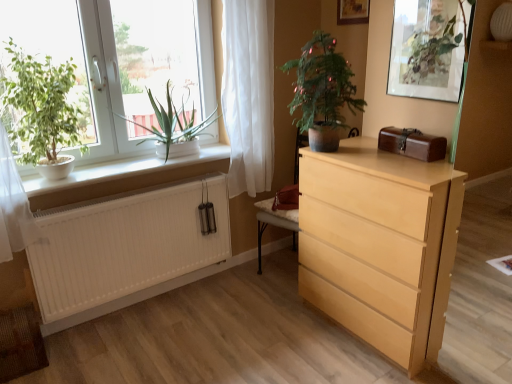
Question: Considering their positions, is white sheer curtain at upper center located in front of or behind green matte plant at left, which is counted as the third houseplant, starting from the right?

Choices:
 (A) behind
 (B) front

Answer: (A)

Question: From a real-world perspective, is white sheer curtain at upper center positioned above or below green matte plant at left, the first houseplant viewed from the left?

Choices:
 (A) below
 (B) above

Answer: (A)

Question: Based on their relative distances, which object is farther from the white plastic window at left?

Choices:
 (A) brown leather box at upper right
 (B) white matte radiator at lower left
 (C) white matte window sill at left
 (D) green matte plant at left, the first houseplant viewed from the left
 (E) light wood chest of drawers at right

Answer: (A)

Question: Which is nearer to the wooden picture frame at upper center?

Choices:
 (A) white matte window sill at left
 (B) green leafy plant at left, which is the second houseplant in left-to-right order
 (C) green matte plant at upper right
 (D) green matte plant at center, the 3th houseplant when ordered from left to right
 (E) green matte plant at left, the first houseplant viewed from the left

Answer: (C)